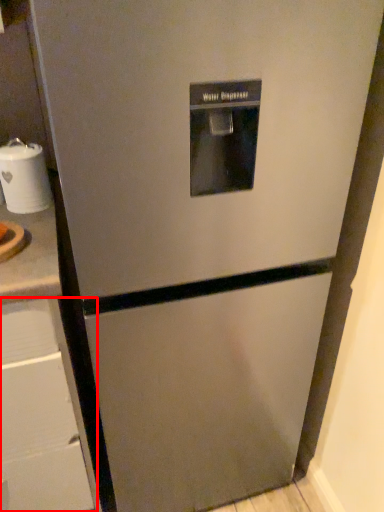
Question: Considering the relative positions of drawer (annotated by the red box) and appliance in the image provided, where is drawer (annotated by the red box) located with respect to the staircase?

Choices:
 (A) left
 (B) right

Answer: (A)